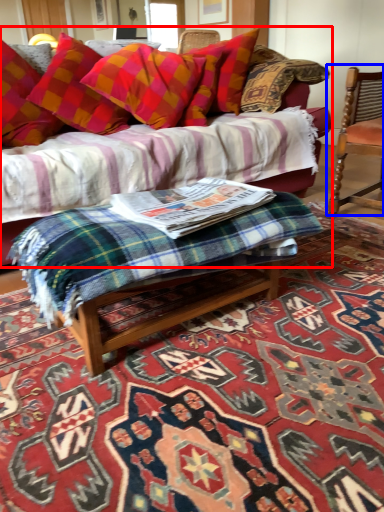
Question: Which of the following is the farthest to the observer, studio couch (highlighted by a red box) or chair (highlighted by a blue box)?

Choices:
 (A) studio couch
 (B) chair

Answer: (B)